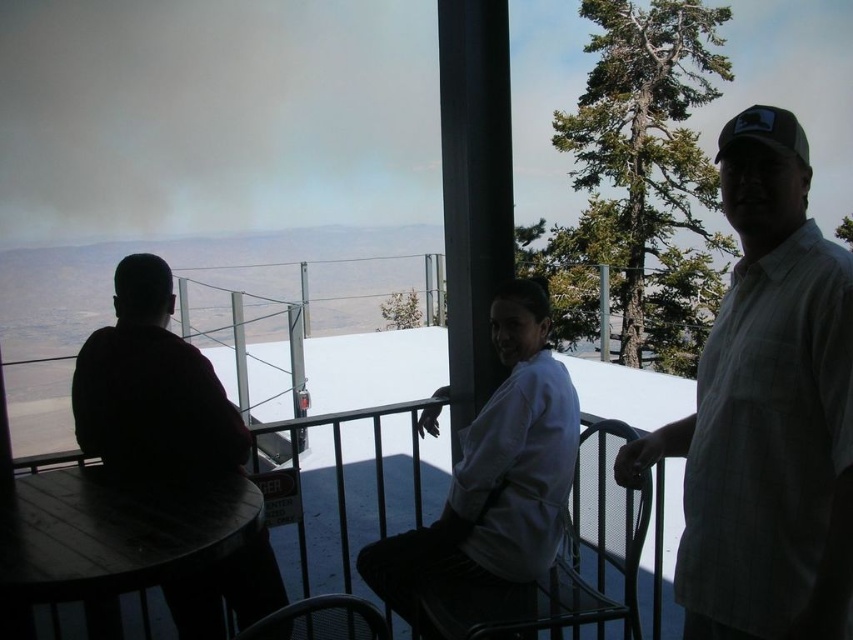
Does white cotton shirt at center appear on the left side of wooden table at center?

No, white cotton shirt at center is not to the left of wooden table at center.

Where is `white cotton shirt at center`? The height and width of the screenshot is (640, 853). white cotton shirt at center is located at coordinates (495, 474).

Does point (525, 342) lie behind point (102, 570)?

Yes, it is.

This screenshot has height=640, width=853. What are the coordinates of `white cotton shirt at center` in the screenshot? It's located at (495, 474).

Is point (793, 518) in front of point (177, 413)?

Yes, point (793, 518) is closer to viewer.

Can you confirm if white checkered shirt at right is bigger than dark matte shirt at left?

Actually, white checkered shirt at right might be smaller than dark matte shirt at left.

Which is in front, point (751, 509) or point (242, 436)?

Point (751, 509)

Identify the location of white checkered shirt at right. (767, 412).

Is point (712, 468) farther from camera compared to point (91, 602)?

No, (712, 468) is in front of (91, 602).

Who is positioned more to the right, white checkered shirt at right or wooden table at center?

white checkered shirt at right is more to the right.

This screenshot has height=640, width=853. What do you see at coordinates (767, 412) in the screenshot? I see `white checkered shirt at right` at bounding box center [767, 412].

Find the location of `white checkered shirt at right`. white checkered shirt at right is located at coordinates (767, 412).